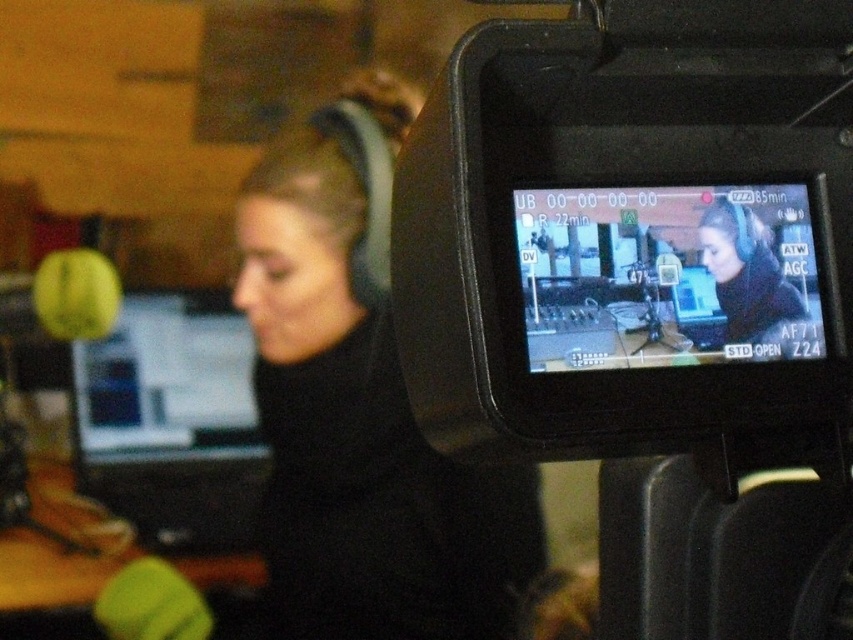
You are a technician adjusting equipment in the studio. You need to reach both the matte black monitor at left and the matte black headphones at upper center. Which one will you have to extend your arm further to reach?

You will have to extend your arm further to reach the matte black headphones at upper center because the matte black monitor at left is closer to you, while the matte black headphones at upper center are farther away.

You are setting up equipment in a studio and need to know if the black plastic camera at center will fit on a shelf that can hold items up to the height of the matte black monitor at left. Can it fit?

The black plastic camera at center is taller than the matte black monitor at left, so it will not fit on the shelf designed for items up to the monitor height.

You are setting up equipment in a studio and need to place a tall stand that requires at least 50 cm of vertical space. You have two options near the matte black monitor at left and the matte black headphones at upper center. Which location has enough vertical space?

The matte black monitor at left has a greater height compared to the matte black headphones at upper center, so the location near the matte black monitor at left has enough vertical space for the tall stand requiring at least 50 cm of vertical space.